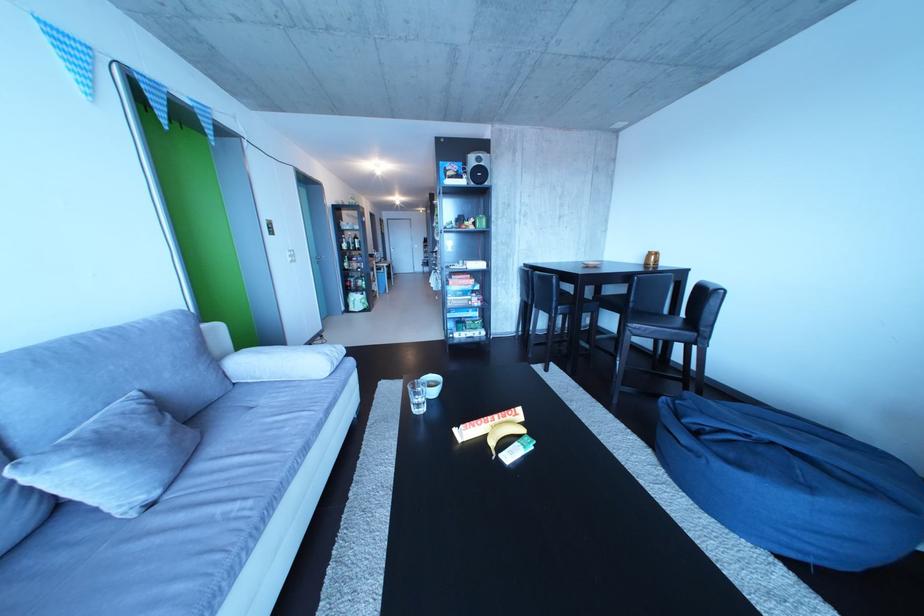
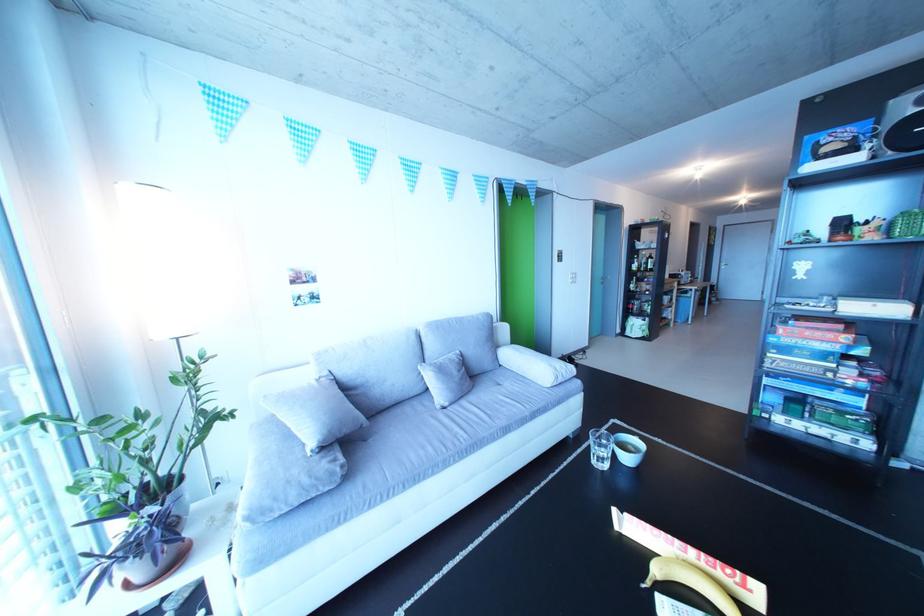
Locate, in the second image, the point that corresponds to [496,339] in the first image.

(881, 451)